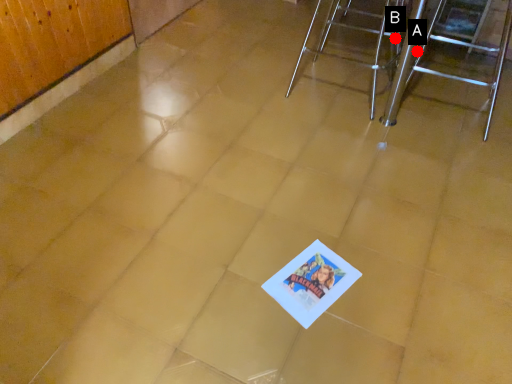
Question: Two points are circled on the image, labeled by A and B beside each circle. Which point is farther from the camera taking this photo?

Choices:
 (A) A is further
 (B) B is further

Answer: (B)